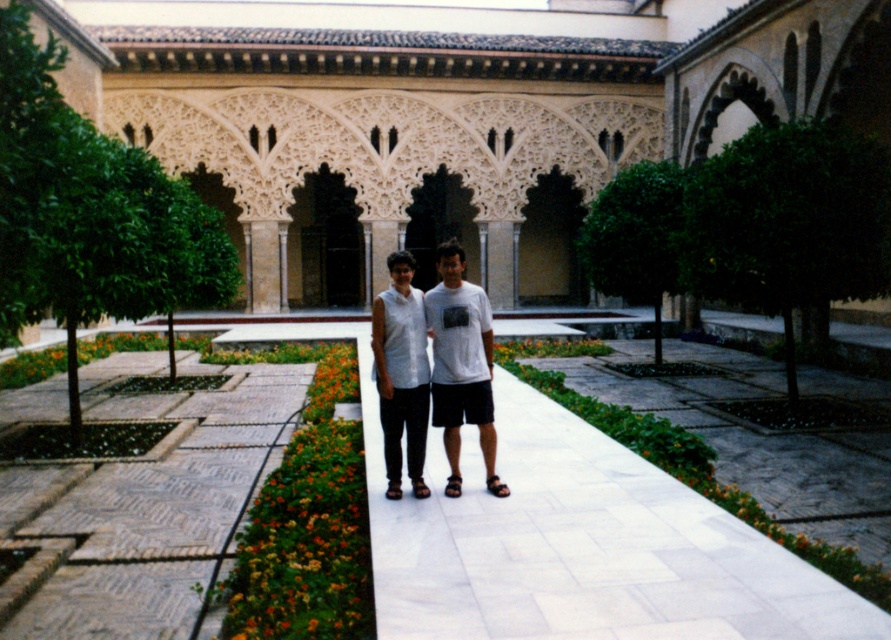
Which is in front, point (455, 173) or point (454, 320)?

Point (454, 320)

Is white stone arches at center thinner than white matte shirt at center?

Incorrect, white stone arches at center's width is not less than white matte shirt at center's.

Which is in front, point (624, 120) or point (471, 348)?

Point (471, 348) is more forward.

This screenshot has height=640, width=891. In order to click on white stone arches at center in this screenshot , I will do `click(448, 115)`.

Can you confirm if white stone path at center is positioned below white matte shirt at center?

Yes, white stone path at center is below white matte shirt at center.

Can you confirm if white stone path at center is positioned above white matte shirt at center?

No, white stone path at center is not above white matte shirt at center.

In order to click on white stone path at center in this screenshot , I will do `click(579, 545)`.

In the scene shown: Can you confirm if white stone arches at center is wider than white cotton shirt at center?

Yes.

Is white stone arches at center shorter than white cotton shirt at center?

Incorrect, white stone arches at center's height does not fall short of white cotton shirt at center's.

This screenshot has height=640, width=891. Describe the element at coordinates (448, 115) in the screenshot. I see `white stone arches at center` at that location.

Where is `white stone arches at center`? The width and height of the screenshot is (891, 640). white stone arches at center is located at coordinates (448, 115).